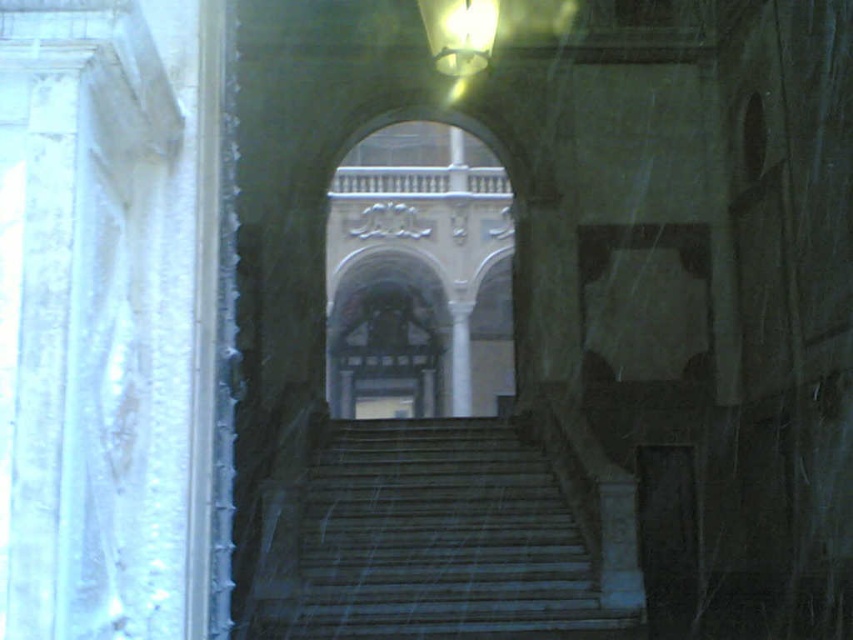
Can you confirm if dark gray stone stairs at center is bigger than white marble archway at center?

Actually, dark gray stone stairs at center might be smaller than white marble archway at center.

Who is taller, dark gray stone stairs at center or white marble archway at center?

white marble archway at center

Image resolution: width=853 pixels, height=640 pixels. What do you see at coordinates (436, 541) in the screenshot? I see `dark gray stone stairs at center` at bounding box center [436, 541].

Find the location of a particular element. The image size is (853, 640). dark gray stone stairs at center is located at coordinates (436, 541).

Who is positioned more to the right, dark gray stone stairs at center or white marble column at center?

From the viewer's perspective, dark gray stone stairs at center appears more on the right side.

Is dark gray stone stairs at center further to camera compared to white marble column at center?

That is False.

Is point (540, 460) in front of point (459, 378)?

Yes, point (540, 460) is closer to viewer.

This screenshot has height=640, width=853. I want to click on dark gray stone stairs at center, so click(x=436, y=541).

Between white marble archway at center and white marble column at center, which one is positioned lower?

white marble column at center is below.

Which is behind, point (502, 340) or point (459, 372)?

Point (502, 340)

Find the location of a particular element. white marble archway at center is located at coordinates (418, 275).